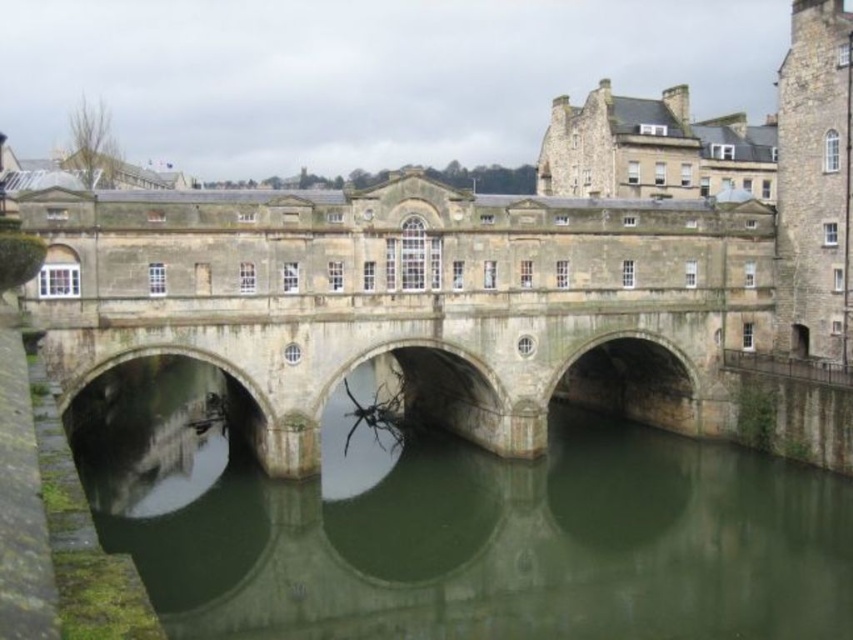
Question: Which point is closer to the camera?

Choices:
 (A) stone bridge at center
 (B) green stone bridge at center

Answer: (B)

Question: Which point is closer to the camera?

Choices:
 (A) (369, 236)
 (B) (149, 536)

Answer: (B)

Question: Is green stone bridge at center to the right of stone bridge at center from the viewer's perspective?

Choices:
 (A) yes
 (B) no

Answer: (B)

Question: From the image, what is the correct spatial relationship of green stone bridge at center in relation to stone bridge at center?

Choices:
 (A) above
 (B) below

Answer: (B)

Question: Considering the relative positions of green stone bridge at center and stone bridge at center in the image provided, where is green stone bridge at center located with respect to stone bridge at center?

Choices:
 (A) above
 (B) below

Answer: (B)

Question: Which point appears closest to the camera in this image?

Choices:
 (A) (187, 321)
 (B) (714, 449)

Answer: (A)